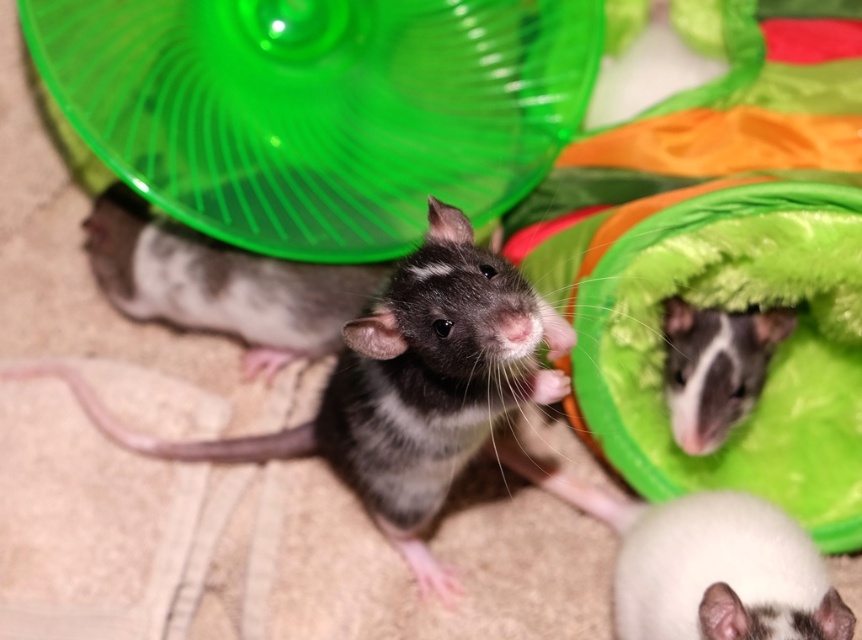
Question: Which point is closer to the camera?

Choices:
 (A) (670, 364)
 (B) (703, 513)

Answer: (B)

Question: Does black and white fur hamster at center have a greater width compared to white fur mouse at upper right?

Choices:
 (A) no
 (B) yes

Answer: (B)

Question: From the image, what is the correct spatial relationship of gray fur mouse at center in relation to white fur mouse at upper right?

Choices:
 (A) left
 (B) right

Answer: (A)

Question: Does black and white fur hamster at center have a smaller size compared to white fur mouse at upper right?

Choices:
 (A) no
 (B) yes

Answer: (A)

Question: Among these points, which one is farthest from the camera?

Choices:
 (A) (709, 586)
 (B) (709, 413)

Answer: (B)

Question: Which of the following is the closest to the observer?

Choices:
 (A) (715, 412)
 (B) (217, 308)

Answer: (A)